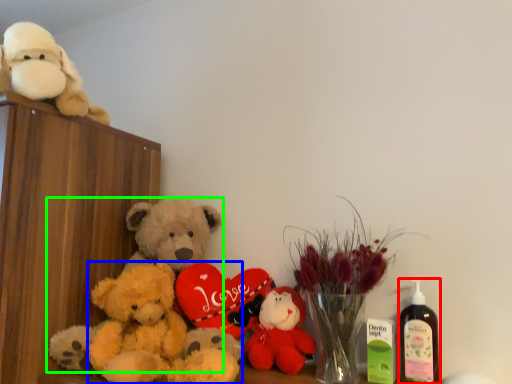
Question: Considering the real-world distances, which object is farthest from bottle (highlighted by a red box)? teddy bear (highlighted by a blue box) or teddy bear (highlighted by a green box)?

Choices:
 (A) teddy bear
 (B) teddy bear

Answer: (B)